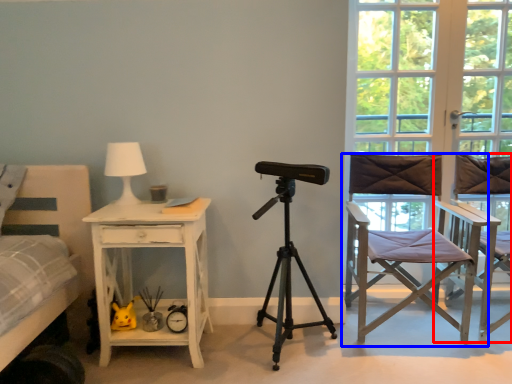
Question: Which point is further to the camera, chair (highlighted by a red box) or chair (highlighted by a blue box)?

Choices:
 (A) chair
 (B) chair

Answer: (B)